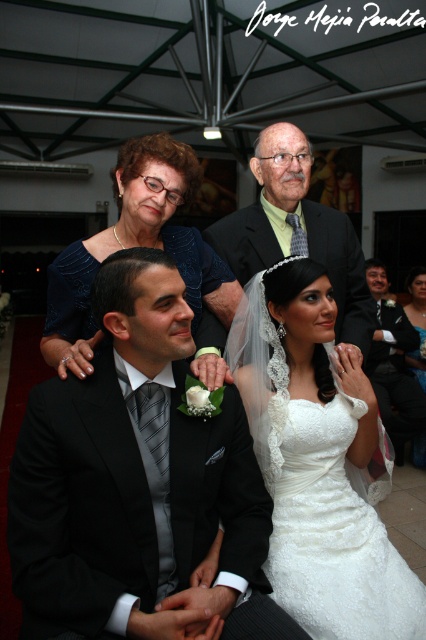
Where is `black satin suit at center`? black satin suit at center is located at coordinates (138, 486).

Image resolution: width=426 pixels, height=640 pixels. Describe the element at coordinates (138, 486) in the screenshot. I see `black satin suit at center` at that location.

Measure the distance between point (x=147, y=608) and camera.

Point (x=147, y=608) and camera are 1.28 meters apart from each other.

This screenshot has width=426, height=640. Find the location of `black satin suit at center`. black satin suit at center is located at coordinates (138, 486).

Does black satin suit at center have a lesser width compared to white lace dress at center?

Incorrect, black satin suit at center's width is not less than white lace dress at center's.

The image size is (426, 640). What are the coordinates of `black satin suit at center` in the screenshot? It's located at (138, 486).

Is white lace dress at center further to camera compared to white satin dress at center?

No, it is not.

Does white lace dress at center have a greater width compared to white satin dress at center?

Yes, white lace dress at center is wider than white satin dress at center.

Who is more distant from viewer, (x=394, y=572) or (x=406, y=307)?

The point (x=406, y=307) is behind.

Image resolution: width=426 pixels, height=640 pixels. Identify the location of white lace dress at center. (319, 461).